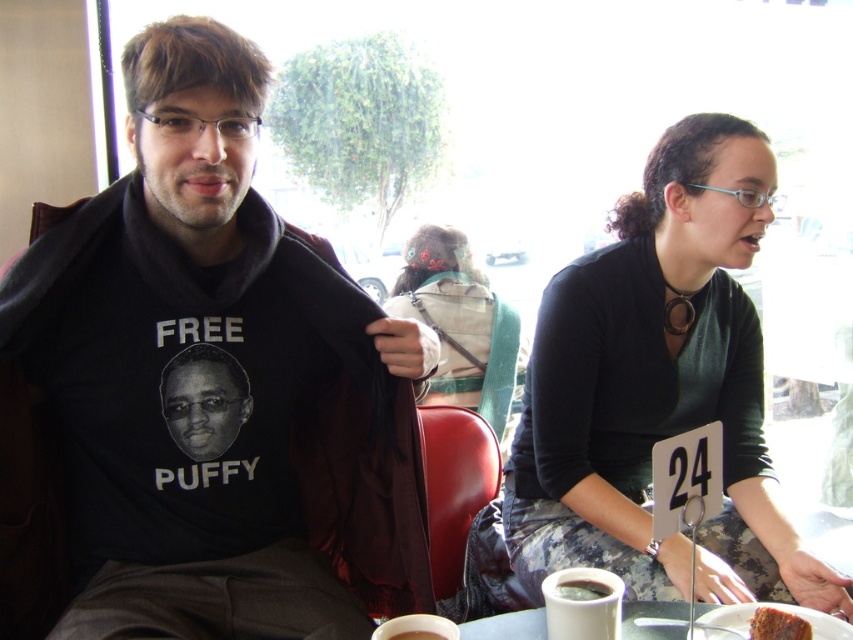
Who is positioned more to the left, white ceramic cup at lower center or brown crumbly cake at lower right?

white ceramic cup at lower center

Between white ceramic cup at lower center and brown crumbly cake at lower right, which one is positioned lower?

brown crumbly cake at lower right

Identify the location of white ceramic cup at lower center. The height and width of the screenshot is (640, 853). 582,604.

Where is `white ceramic cup at lower center`? This screenshot has height=640, width=853. white ceramic cup at lower center is located at coordinates (582, 604).

Does black matte hoodie at left have a greater height compared to brown crumbly cake at lower right?

Yes, black matte hoodie at left is taller than brown crumbly cake at lower right.

Is black matte hoodie at left above brown crumbly cake at lower right?

Yes, black matte hoodie at left is above brown crumbly cake at lower right.

Locate an element on the screen. Image resolution: width=853 pixels, height=640 pixels. black matte hoodie at left is located at coordinates (160, 396).

Is matte green blouse at center above white ceramic mug at lower center?

Yes.

Does matte green blouse at center appear under white ceramic mug at lower center?

No.

Locate an element on the screen. The width and height of the screenshot is (853, 640). matte green blouse at center is located at coordinates (659, 387).

Where is `matte green blouse at center`? This screenshot has width=853, height=640. matte green blouse at center is located at coordinates (659, 387).